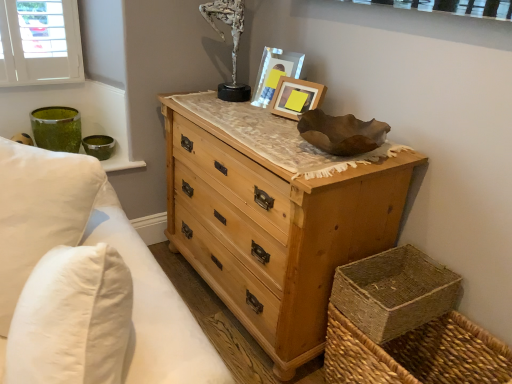
What do you see at coordinates (275, 73) in the screenshot? I see `matte wooden picture frame at upper center, the 2th picture frame positioned from the front` at bounding box center [275, 73].

What do you see at coordinates (86, 283) in the screenshot? I see `white cotton pillows at left` at bounding box center [86, 283].

This screenshot has height=384, width=512. Describe the element at coordinates (274, 229) in the screenshot. I see `natural wood chest of drawers at center` at that location.

The width and height of the screenshot is (512, 384). In order to click on natural wood chest of drawers at center in this screenshot , I will do `click(274, 229)`.

Identify the location of matte wooden picture frame at upper center, the 2th picture frame positioned from the front. (275, 73).

Are woven brown basket at lower right and matte wooden picture frame at upper center, the 2th picture frame positioned from the front, located far from each other?

Yes, woven brown basket at lower right is far from matte wooden picture frame at upper center, the 2th picture frame positioned from the front.

In the image, is woven brown basket at lower right on the left side or the right side of matte wooden picture frame at upper center, the 2th picture frame positioned from the front?

woven brown basket at lower right is positioned on matte wooden picture frame at upper center, the 2th picture frame positioned from the front,'s right side.

Does woven brown basket at lower right have a lesser width compared to matte wooden picture frame at upper center, the 1th picture frame when ordered from back to front?

In fact, woven brown basket at lower right might be wider than matte wooden picture frame at upper center, the 1th picture frame when ordered from back to front.

From a real-world perspective, does woven brown basket at lower right sit lower than matte wooden picture frame at upper center, the 2th picture frame positioned from the front?

Yes, from a real-world perspective, woven brown basket at lower right is under matte wooden picture frame at upper center, the 2th picture frame positioned from the front.

Which is in front, point (384, 189) or point (284, 113)?

Point (384, 189)

Is natural wood chest of drawers at center looking in the opposite direction of wooden picture frame at upper center, acting as the first picture frame starting from the front?

No, wooden picture frame at upper center, acting as the first picture frame starting from the front, is not at the back of natural wood chest of drawers at center.

From the image's perspective, relative to wooden picture frame at upper center, acting as the first picture frame starting from the front, is natural wood chest of drawers at center above or below?

From the image's perspective, natural wood chest of drawers at center appears below wooden picture frame at upper center, acting as the first picture frame starting from the front.

From the image's perspective, would you say woven natural basket at lower right is shown under woven brown basket at lower right?

Actually, woven natural basket at lower right appears above woven brown basket at lower right in the image.

Who is bigger, woven natural basket at lower right or woven brown basket at lower right?

Bigger between the two is woven brown basket at lower right.

Could you tell me if woven natural basket at lower right is facing woven brown basket at lower right?

No, woven natural basket at lower right is not oriented towards woven brown basket at lower right.

Does woven natural basket at lower right touch natural wood chest of drawers at center?

There is a gap between woven natural basket at lower right and natural wood chest of drawers at center.

Is woven natural basket at lower right to the left of natural wood chest of drawers at center from the viewer's perspective?

Incorrect, woven natural basket at lower right is not on the left side of natural wood chest of drawers at center.

Is woven natural basket at lower right facing towards natural wood chest of drawers at center?

No, woven natural basket at lower right is not turned towards natural wood chest of drawers at center.

Which object is more forward, natural wood chest of drawers at center or woven natural basket at lower right?

natural wood chest of drawers at center is in front.

In the scene shown: Looking at the image, does natural wood chest of drawers at center seem bigger or smaller compared to woven natural basket at lower right?

Clearly, natural wood chest of drawers at center is larger in size than woven natural basket at lower right.

Which is behind, point (200, 263) or point (420, 302)?

The point (200, 263) is farther.

Looking at their sizes, would you say natural wood chest of drawers at center is wider or thinner than woven natural basket at lower right?

Clearly, natural wood chest of drawers at center has more width compared to woven natural basket at lower right.

Is the position of woven brown basket at lower right more distant than that of white cotton pillows at left?

That is True.

Based on the photo, is woven brown basket at lower right oriented towards white cotton pillows at left?

Yes, woven brown basket at lower right is turned towards white cotton pillows at left.

From their relative heights in the image, would you say woven brown basket at lower right is taller or shorter than white cotton pillows at left?

woven brown basket at lower right is shorter than white cotton pillows at left.

From a real-world perspective, who is located lower, woven brown basket at lower right or white cotton pillows at left?

woven brown basket at lower right, from a real-world perspective.

At what (x,y) coordinates should I click in order to perform the action: click on the 2nd picture frame positioned above the white cotton pillows at left (from a real-world perspective). Please return your answer as a coordinate pair (x, y). This screenshot has width=512, height=384. Looking at the image, I should click on (275, 73).

Is white cotton pillows at left directly adjacent to matte wooden picture frame at upper center, the 1th picture frame when ordered from back to front?

No, white cotton pillows at left is not in contact with matte wooden picture frame at upper center, the 1th picture frame when ordered from back to front.

Does white cotton pillows at left have a greater width compared to matte wooden picture frame at upper center, the 1th picture frame when ordered from back to front?

Indeed, white cotton pillows at left has a greater width compared to matte wooden picture frame at upper center, the 1th picture frame when ordered from back to front.

Who is shorter, white cotton pillows at left or matte wooden picture frame at upper center, the 2th picture frame positioned from the front?

matte wooden picture frame at upper center, the 2th picture frame positioned from the front.

The height and width of the screenshot is (384, 512). What are the coordinates of `basket below the matte wooden picture frame at upper center, the 2th picture frame positioned from the front (from a real-world perspective)` in the screenshot? It's located at (416, 354).

From the image's perspective, which picture frame is the 1st one above the natural wood chest of drawers at center? Please provide its 2D coordinates.

[(296, 97)]

When comparing their distances from woven natural basket at lower right, does white cotton pillows at left or matte wooden picture frame at upper center, the 2th picture frame positioned from the front, seem further?

matte wooden picture frame at upper center, the 2th picture frame positioned from the front.

Looking at the image, which one is located further to wooden picture frame at upper center, which is counted as the 2th picture frame, starting from the back, white cotton pillows at left or matte wooden picture frame at upper center, the 2th picture frame positioned from the front?

The object further to wooden picture frame at upper center, which is counted as the 2th picture frame, starting from the back, is white cotton pillows at left.

Based on their spatial positions, is natural wood chest of drawers at center or white cotton pillows at left further from wooden picture frame at upper center, acting as the first picture frame starting from the front?

Based on the image, white cotton pillows at left appears to be further to wooden picture frame at upper center, acting as the first picture frame starting from the front.

Estimate the real-world distances between objects in this image. Which object is further from wooden picture frame at upper center, acting as the first picture frame starting from the front, natural wood chest of drawers at center or woven brown basket at lower right?

woven brown basket at lower right lies further to wooden picture frame at upper center, acting as the first picture frame starting from the front, than the other object.

When comparing their distances from natural wood chest of drawers at center, does woven brown basket at lower right or white cotton pillows at left seem further?

woven brown basket at lower right is further to natural wood chest of drawers at center.

When comparing their distances from matte wooden picture frame at upper center, the 1th picture frame when ordered from back to front, does wooden picture frame at upper center, acting as the first picture frame starting from the front, or woven brown basket at lower right seem further?

Answer: Based on the image, woven brown basket at lower right appears to be further to matte wooden picture frame at upper center, the 1th picture frame when ordered from back to front.

Based on their spatial positions, is woven natural basket at lower right or wooden picture frame at upper center, acting as the first picture frame starting from the front, closer to matte wooden picture frame at upper center, the 1th picture frame when ordered from back to front?

Based on the image, wooden picture frame at upper center, acting as the first picture frame starting from the front, appears to be nearer to matte wooden picture frame at upper center, the 1th picture frame when ordered from back to front.

Based on their spatial positions, is wooden picture frame at upper center, acting as the first picture frame starting from the front, or white cotton pillows at left closer to woven brown basket at lower right?

The object closer to woven brown basket at lower right is wooden picture frame at upper center, acting as the first picture frame starting from the front.

This screenshot has height=384, width=512. Find the location of `picture frame that lies between matte wooden picture frame at upper center, the 1th picture frame when ordered from back to front, and woven natural basket at lower right from top to bottom`. picture frame that lies between matte wooden picture frame at upper center, the 1th picture frame when ordered from back to front, and woven natural basket at lower right from top to bottom is located at coordinates (296, 97).

Find the location of a particular element. chest of drawers between white cotton pillows at left and matte wooden picture frame at upper center, the 2th picture frame positioned from the front, along the z-axis is located at coordinates (274, 229).

Locate an element on the screen. basket container between natural wood chest of drawers at center and woven brown basket at lower right is located at coordinates (394, 292).

Locate an element on the screen. This screenshot has width=512, height=384. the chest of drawers that lies between wooden picture frame at upper center, acting as the first picture frame starting from the front, and woven brown basket at lower right from top to bottom is located at coordinates (274, 229).